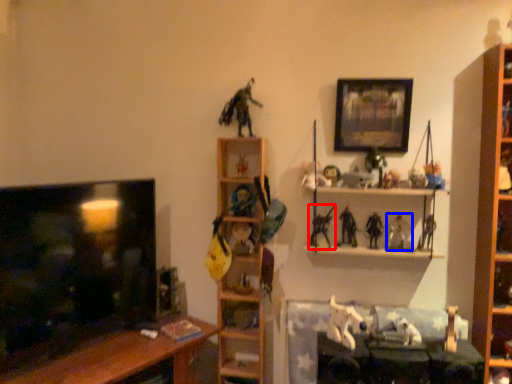
Question: Among these objects, which one is farthest to the camera, toy (highlighted by a red box) or toy (highlighted by a blue box)?

Choices:
 (A) toy
 (B) toy

Answer: (B)